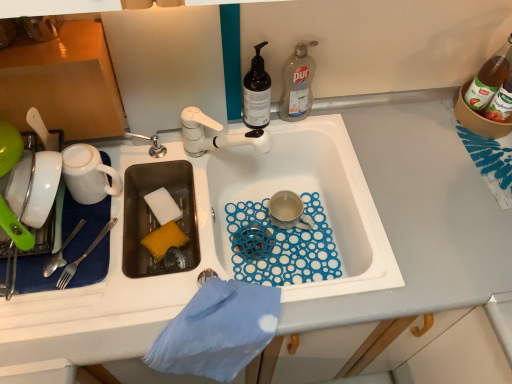
This screenshot has height=384, width=512. Identify the location of vacant area on the back side of white matte mug at upper left, marked as the 2th coffee cup in a back-to-front arrangement. (135, 151).